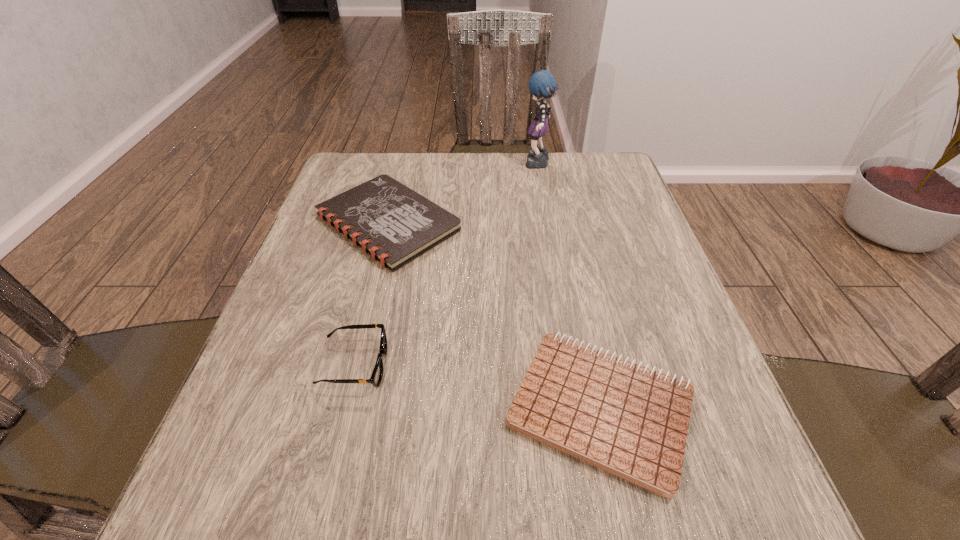
Find the location of a particular element. free space between the second tallest object and the left notebook is located at coordinates (372, 294).

The image size is (960, 540). What are the coordinates of `empty location between the farthest object and the shorter notebook` in the screenshot? It's located at (569, 287).

At what (x,y) coordinates should I click in order to perform the action: click on empty space that is in between the farther notebook and the sunglasses. Please return your answer as a coordinate pair (x, y). Looking at the image, I should click on (372, 294).

I want to click on free space between the farther notebook and the farthest object, so click(463, 194).

This screenshot has width=960, height=540. Identify the location of vacant space in between the third shortest object and the rag doll. (446, 265).

The image size is (960, 540). I want to click on empty space that is in between the right notebook and the rag doll, so click(569, 287).

Identify the location of empty location between the second tallest object and the nearer notebook. (478, 387).

Locate an element on the screen. Image resolution: width=960 pixels, height=540 pixels. object that is the closest to the second farthest object is located at coordinates (542, 84).

Select which object is the closest to the left notebook. Please provide its 2D coordinates. Your answer should be formatted as a tuple, i.e. [(x, y)], where the tuple contains the x and y coordinates of a point satisfying the conditions above.

[(542, 84)]

Find the location of a particular element. vacant area in the image that satisfies the following two spatial constraints: 1. on the back side of the shortest object; 2. on the front-facing side of the rag doll is located at coordinates (548, 165).